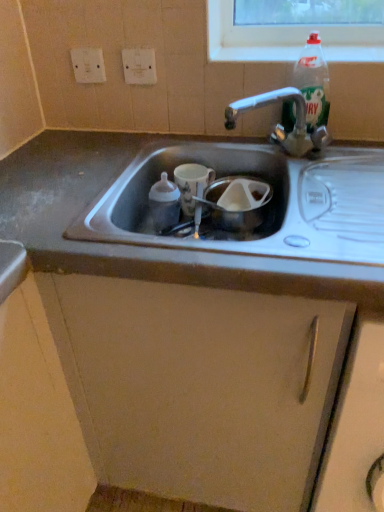
Question: Is white plastic electric outlet at upper center, which is counted as the 1th electric outlet, starting from the right, touching white glossy cup at center?

Choices:
 (A) yes
 (B) no

Answer: (B)

Question: Is white plastic electric outlet at upper center, which is counted as the 1th electric outlet, starting from the right, shorter than white glossy cup at center?

Choices:
 (A) no
 (B) yes

Answer: (B)

Question: Is white plastic electric outlet at upper center, which is counted as the 1th electric outlet, starting from the right, thinner than white glossy cup at center?

Choices:
 (A) yes
 (B) no

Answer: (A)

Question: Is white plastic electric outlet at upper center, which is counted as the 1th electric outlet, starting from the right, smaller than white glossy cup at center?

Choices:
 (A) yes
 (B) no

Answer: (A)

Question: From a real-world perspective, is white plastic electric outlet at upper center, the second electric outlet viewed from the left, beneath white glossy cup at center?

Choices:
 (A) no
 (B) yes

Answer: (A)

Question: Considering their positions, is clear glass bottle at upper center located in front of or behind matte plastic bottle at sink center, the first bottle positioned from the bottom?

Choices:
 (A) front
 (B) behind

Answer: (B)

Question: Do you think clear glass bottle at upper center is within matte plastic bottle at sink center, the first bottle positioned from the bottom, or outside of it?

Choices:
 (A) outside
 (B) inside

Answer: (A)

Question: Looking at their shapes, would you say clear glass bottle at upper center is wider or thinner than matte plastic bottle at sink center, the first bottle positioned from the bottom?

Choices:
 (A) wide
 (B) thin

Answer: (A)

Question: From a real-world perspective, is clear glass bottle at upper center physically located above or below matte plastic bottle at sink center, acting as the 1th bottle starting from the left?

Choices:
 (A) below
 (B) above

Answer: (B)

Question: Is clear plastic bottle at upper right, marked as the 2th bottle in a left-to-right arrangement, situated inside white plastic electric outlet at upper center, the second electric outlet viewed from the left, or outside?

Choices:
 (A) inside
 (B) outside

Answer: (B)

Question: From a real-world perspective, is clear plastic bottle at upper right, which ranks as the second bottle in bottom-to-top order, physically located above or below white plastic electric outlet at upper center, which is counted as the 1th electric outlet, starting from the right?

Choices:
 (A) below
 (B) above

Answer: (A)

Question: In the image, is clear plastic bottle at upper right, which appears as the 1th bottle when viewed from the right, positioned in front of or behind white plastic electric outlet at upper center, the second electric outlet viewed from the left?

Choices:
 (A) front
 (B) behind

Answer: (A)

Question: From the image's perspective, is clear plastic bottle at upper right, marked as the 2th bottle in a left-to-right arrangement, positioned above or below white plastic electric outlet at upper center, which is counted as the 1th electric outlet, starting from the right?

Choices:
 (A) below
 (B) above

Answer: (A)

Question: Based on their sizes in the image, would you say matte plastic bottle at sink center, the second bottle when ordered from right to left, is bigger or smaller than clear glass bottle at upper center?

Choices:
 (A) big
 (B) small

Answer: (B)

Question: In terms of width, does matte plastic bottle at sink center, acting as the 1th bottle starting from the left, look wider or thinner when compared to clear glass bottle at upper center?

Choices:
 (A) thin
 (B) wide

Answer: (A)